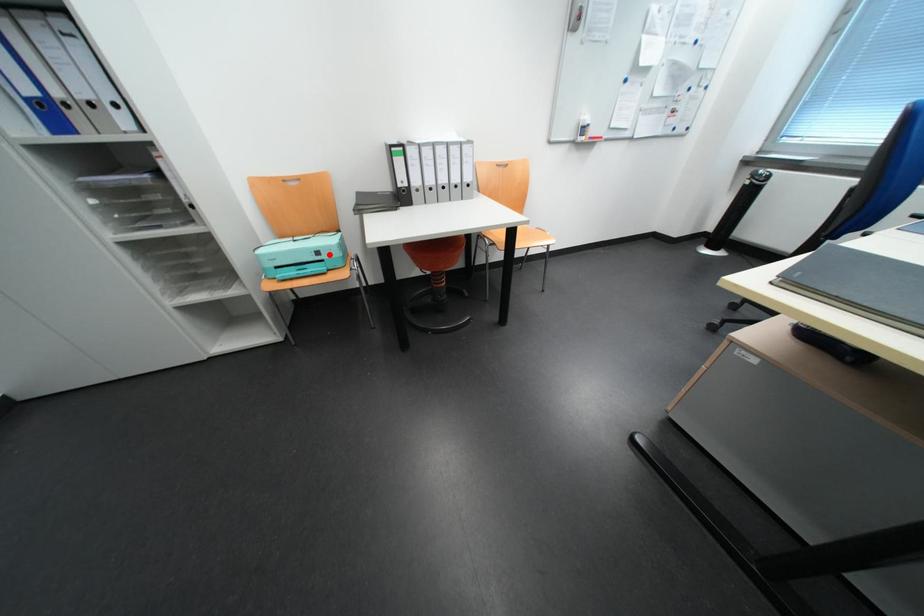
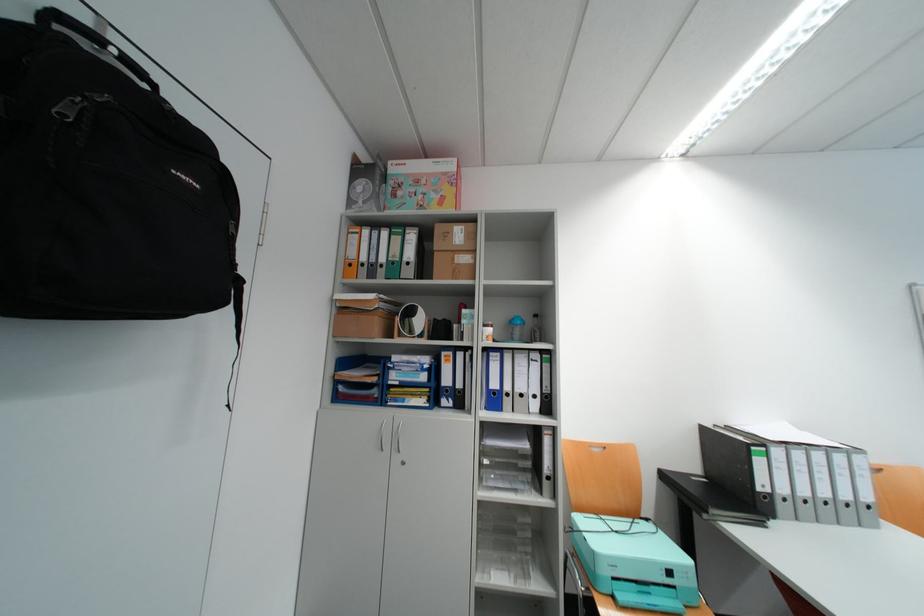
Question: I am providing you with two images of the same scene from different viewpoints. Image1 has a red point marked. In image2, the corresponding 3D location appears at what relative position? Reply with the corresponding letter.

Choices:
 (A) Closer
 (B) Farther

Answer: (B)